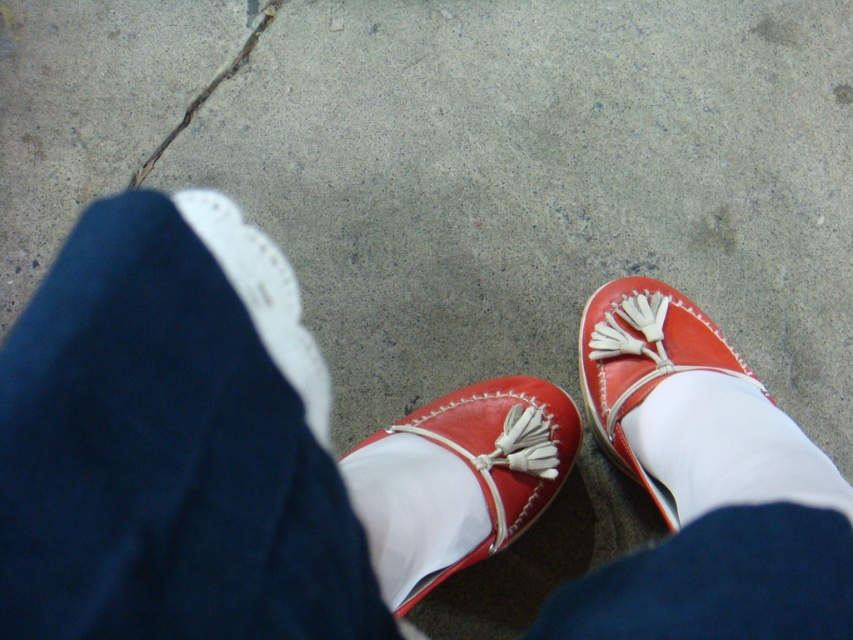
Is point (469, 522) positioned behind point (677, 387)?

No, it is in front of (677, 387).

Is point (409, 467) behind point (779, 460)?

Yes, it is behind point (779, 460).

Image resolution: width=853 pixels, height=640 pixels. I want to click on leather/matte shoe at center, so click(x=459, y=480).

Who is more distant from viewer, (402, 476) or (286, 308)?

Positioned behind is point (286, 308).

At what (x,y) coordinates should I click in order to perform the action: click on white smooth sock at center. Please return your answer as a coordinate pair (x, y). This screenshot has height=640, width=853. Looking at the image, I should click on (413, 508).

From the picture: Which is above, matte leather shoe at lower right or white leather shoe at left?

white leather shoe at left is above.

Which is in front, point (648, 301) or point (321, 436)?

Point (648, 301)

I want to click on matte leather shoe at lower right, so click(x=643, y=362).